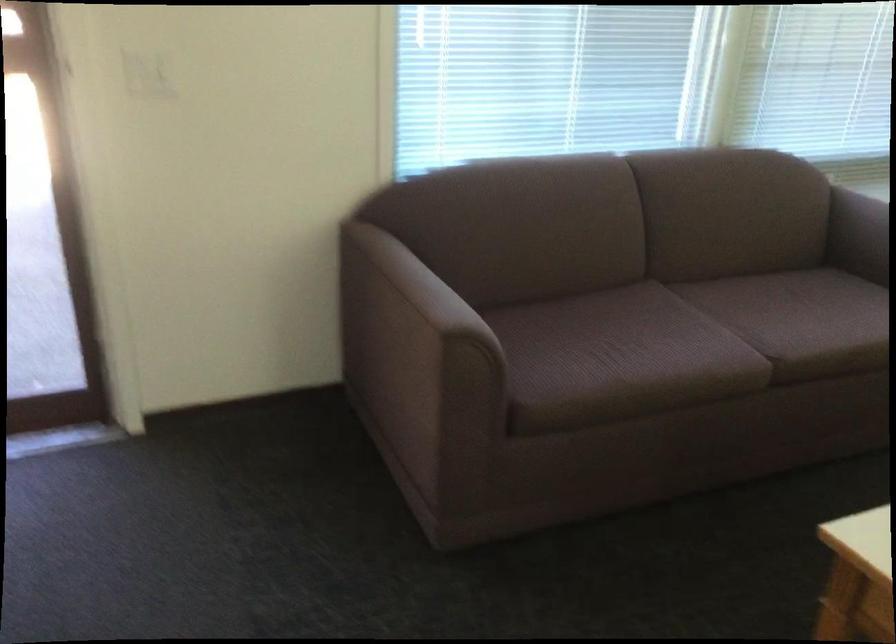
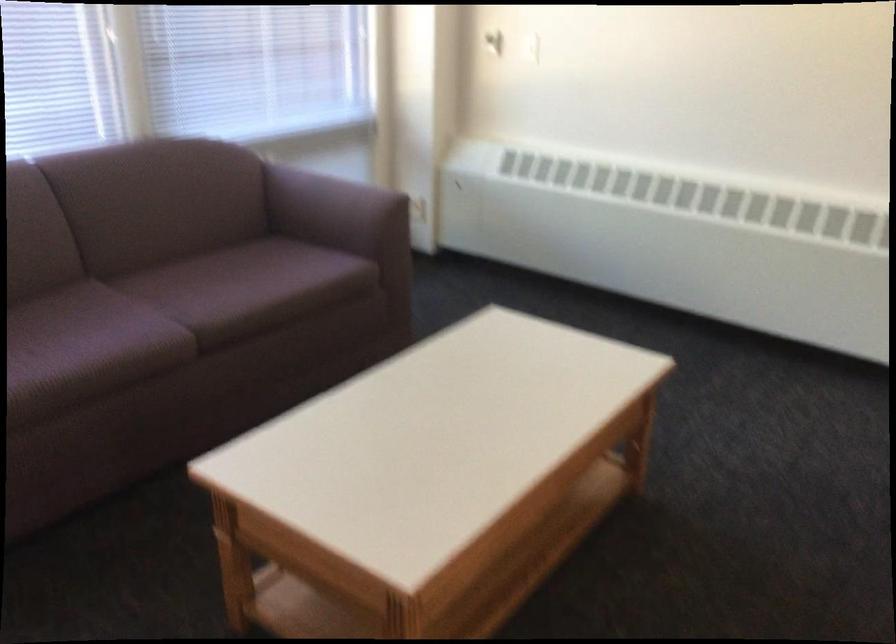
The images are taken continuously from a first-person perspective. In which direction are you moving?

The cameraman walked toward right, backward.